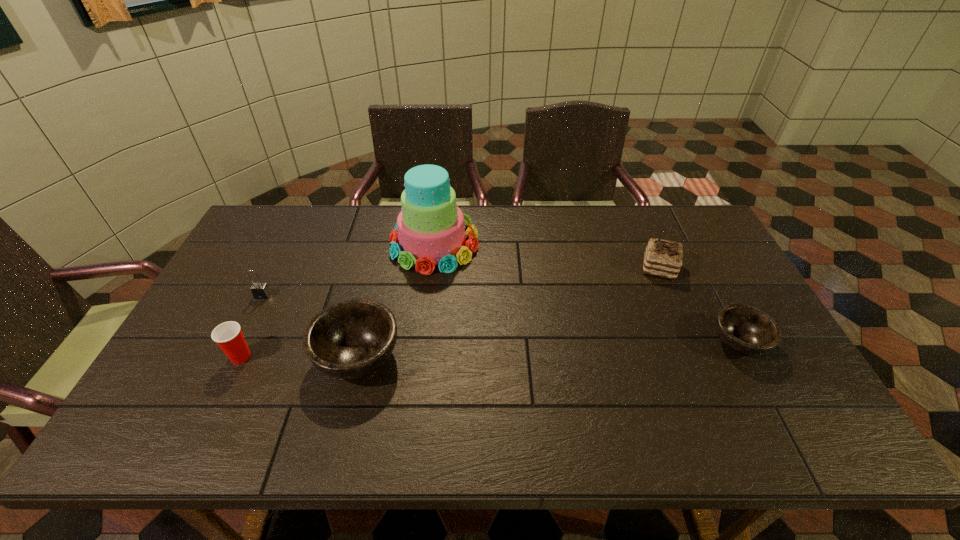
The image size is (960, 540). Identify the location of vacant area at the left edge of the desktop. (246, 306).

Where is `free space at the right edge`? Image resolution: width=960 pixels, height=540 pixels. free space at the right edge is located at coordinates (724, 274).

The width and height of the screenshot is (960, 540). Identify the location of blank space at the far left corner of the desktop. (274, 208).

At what (x,y) coordinates should I click in order to perform the action: click on free location at the near left corner. Please return your answer as a coordinate pair (x, y). Looking at the image, I should click on (176, 392).

Identify the location of free space at the far right corner. The height and width of the screenshot is (540, 960). (656, 215).

Identify the location of free space between the left bowl and the Dixie cup. Image resolution: width=960 pixels, height=540 pixels. (300, 357).

Where is `free area in between the chocolate cake and the left bowl`? free area in between the chocolate cake and the left bowl is located at coordinates (509, 312).

At what (x,y) coordinates should I click in order to perform the action: click on empty location between the taller bowl and the shorter bowl. Please return your answer as a coordinate pair (x, y). The image size is (960, 540). Looking at the image, I should click on (x=548, y=349).

Identify the location of vacant region between the Dixie cup and the shorter bowl. (490, 349).

At what (x,y) coordinates should I click in order to perform the action: click on unoccupied position between the cake and the Dixie cup. Please return your answer as a coordinate pair (x, y). Looking at the image, I should click on (338, 300).